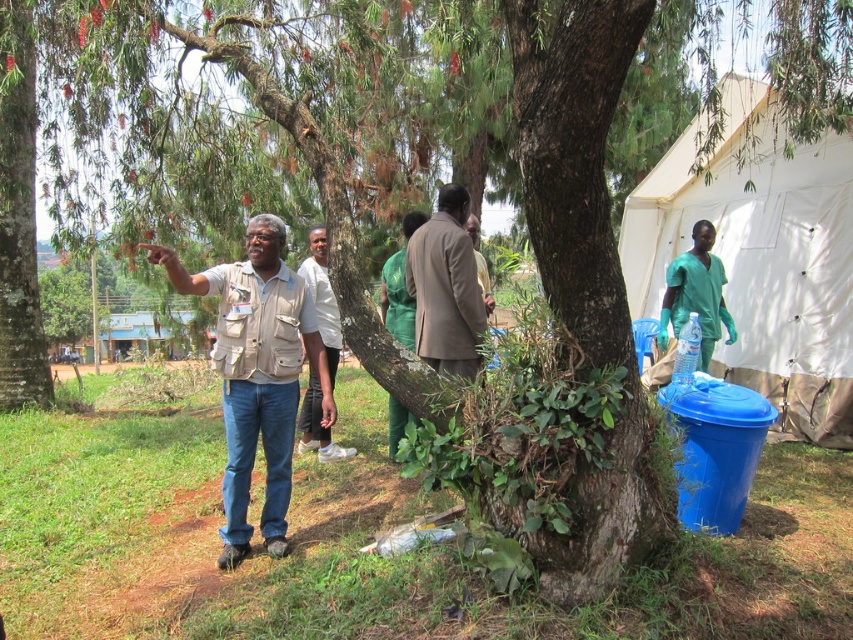
Does brown fabric jacket at center appear under white matte shirt at center?

Actually, brown fabric jacket at center is above white matte shirt at center.

Who is shorter, brown fabric jacket at center or white matte shirt at center?

Standing shorter between the two is brown fabric jacket at center.

Between point (466, 282) and point (314, 419), which one is positioned in front?

Point (466, 282) is more forward.

Locate an element on the screen. The width and height of the screenshot is (853, 640). brown fabric jacket at center is located at coordinates (445, 289).

Between point (274, 225) and point (312, 296), which one is positioned behind?

The point (312, 296) is behind.

Between beige fabric shirt at center and white matte shirt at center, which one is positioned higher?

white matte shirt at center is higher up.

Does point (248, 438) lie in front of point (308, 436)?

That is True.

Where is `beige fabric shirt at center`? The image size is (853, 640). beige fabric shirt at center is located at coordinates (x=257, y=372).

Does green scrubs at right appear on the right side of white matte shirt at center?

Indeed, green scrubs at right is positioned on the right side of white matte shirt at center.

What do you see at coordinates (695, 292) in the screenshot? The image size is (853, 640). I see `green scrubs at right` at bounding box center [695, 292].

Describe the element at coordinates (695, 292) in the screenshot. I see `green scrubs at right` at that location.

The image size is (853, 640). Identify the location of green scrubs at right. (695, 292).